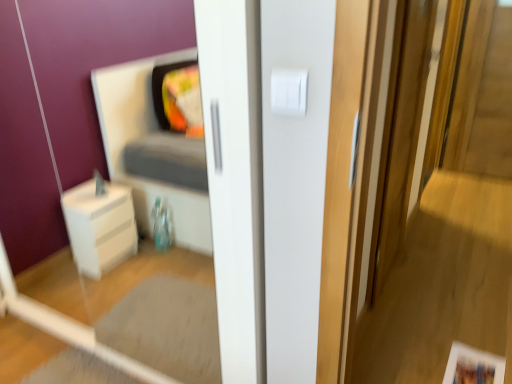
Identify the location of wooden screen door at right. (400, 136).

Describe the element at coordinates (400, 136) in the screenshot. I see `wooden screen door at right` at that location.

You are a GUI agent. You are given a task and a screenshot of the screen. Output one action in this format:
    pyautogui.click(x=<x>, y=<y>)
    Task: Click on the white plastic light switch at upper center
    
    Given the screenshot: What is the action you would take?
    pyautogui.click(x=289, y=91)

What do you see at coordinates (289, 91) in the screenshot? I see `white plastic light switch at upper center` at bounding box center [289, 91].

Measure the distance between point (298, 115) and camera.

37.56 inches.

This screenshot has width=512, height=384. Identify the location of wooden screen door at right. (400, 136).

Which object is positioned more to the right, white plastic light switch at upper center or wooden screen door at right?

wooden screen door at right.

Is white plastic light switch at upper center further to camera compared to wooden screen door at right?

No, it is in front of wooden screen door at right.

Which is behind, point (303, 75) or point (414, 85)?

The point (414, 85) is farther.

From the picture: From the image's perspective, is white plastic light switch at upper center on top of wooden screen door at right?

Yes, from the image's perspective, white plastic light switch at upper center is on top of wooden screen door at right.

From a real-world perspective, is white plastic light switch at upper center physically located above or below wooden screen door at right?

white plastic light switch at upper center is above wooden screen door at right.

Looking at their sizes, would you say white plastic light switch at upper center is wider or thinner than wooden screen door at right?

Clearly, white plastic light switch at upper center has less width compared to wooden screen door at right.

Looking at this image, can you confirm if white plastic light switch at upper center is shorter than wooden screen door at right?

Correct, white plastic light switch at upper center is not as tall as wooden screen door at right.

Is white plastic light switch at upper center bigger or smaller than wooden screen door at right?

Clearly, white plastic light switch at upper center is smaller in size than wooden screen door at right.

Is white plastic light switch at upper center situated inside wooden screen door at right or outside?

white plastic light switch at upper center is not inside wooden screen door at right, it's outside.

Is white plastic light switch at upper center far away from wooden screen door at right?

white plastic light switch at upper center is positioned a significant distance from wooden screen door at right.

Looking at this image, is wooden screen door at right at the back of white plastic light switch at upper center?

No, wooden screen door at right is not at the back of white plastic light switch at upper center.

How different are the orientations of white plastic light switch at upper center and wooden screen door at right in degrees?

89.4 degrees.

Locate an element on the screen. Image resolution: width=512 pixels, height=384 pixels. screen door to the right of white plastic light switch at upper center is located at coordinates (400, 136).

Is wooden screen door at right at the right side of white plastic light switch at upper center?

Yes, wooden screen door at right is to the right of white plastic light switch at upper center.

Considering their positions, is wooden screen door at right located in front of or behind white plastic light switch at upper center?

Clearly, wooden screen door at right is behind white plastic light switch at upper center.

Is point (400, 97) more distant than point (292, 90)?

Yes.

From the image's perspective, is wooden screen door at right above or below white plastic light switch at upper center?

From the image's perspective, wooden screen door at right appears below white plastic light switch at upper center.

From a real-world perspective, is wooden screen door at right physically located above or below white plastic light switch at upper center?

wooden screen door at right is below white plastic light switch at upper center.

Which of these two, wooden screen door at right or white plastic light switch at upper center, is thinner?

With smaller width is white plastic light switch at upper center.

Considering the sizes of objects wooden screen door at right and white plastic light switch at upper center in the image provided, who is shorter, wooden screen door at right or white plastic light switch at upper center?

Standing shorter between the two is white plastic light switch at upper center.

Is wooden screen door at right bigger than white plastic light switch at upper center?

Yes.

Is white plastic light switch at upper center located within wooden screen door at right?

No, white plastic light switch at upper center is located outside of wooden screen door at right.

Is wooden screen door at right far from white plastic light switch at upper center?

wooden screen door at right is far away from white plastic light switch at upper center.

Does wooden screen door at right turn towards white plastic light switch at upper center?

No, wooden screen door at right is not facing towards white plastic light switch at upper center.

Locate an element on the screen. screen door on the right of white plastic light switch at upper center is located at coordinates (400, 136).

I want to click on screen door below the white plastic light switch at upper center (from the image's perspective), so click(400, 136).

The height and width of the screenshot is (384, 512). I want to click on screen door behind the white plastic light switch at upper center, so click(x=400, y=136).